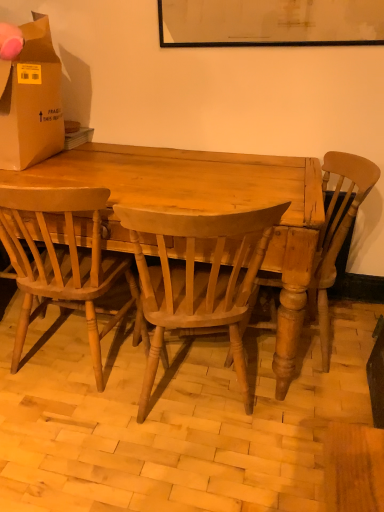
Question: Is light brown wood chair at center, which ranks as the 3th chair in left-to-right order, far away from brown cardboard box at upper left?

Choices:
 (A) no
 (B) yes

Answer: (B)

Question: From a real-world perspective, is light brown wood chair at center, which ranks as the 3th chair in left-to-right order, over brown cardboard box at upper left?

Choices:
 (A) yes
 (B) no

Answer: (B)

Question: From the image's perspective, is light brown wood chair at center, which ranks as the 3th chair in left-to-right order, located above brown cardboard box at upper left?

Choices:
 (A) yes
 (B) no

Answer: (B)

Question: Does light brown wood chair at center, which ranks as the 3th chair in left-to-right order, have a lesser height compared to brown cardboard box at upper left?

Choices:
 (A) yes
 (B) no

Answer: (B)

Question: Does light brown wood chair at center, acting as the 1th chair starting from the right, come behind brown cardboard box at upper left?

Choices:
 (A) yes
 (B) no

Answer: (B)

Question: Looking at their shapes, would you say brown cardboard box at upper left is wider or thinner than light brown wood chair at center, which is the second chair from right to left?

Choices:
 (A) wide
 (B) thin

Answer: (B)

Question: In terms of size, does brown cardboard box at upper left appear bigger or smaller than light brown wood chair at center, which is the second chair from right to left?

Choices:
 (A) big
 (B) small

Answer: (B)

Question: From the image's perspective, relative to light brown wood chair at center, which is the second chair from right to left, is brown cardboard box at upper left above or below?

Choices:
 (A) above
 (B) below

Answer: (A)

Question: Does point (54, 95) appear closer or farther from the camera than point (243, 311)?

Choices:
 (A) farther
 (B) closer

Answer: (A)

Question: From the image's perspective, is light brown wood desk at center positioned above or below light brown wood chair at center, which ranks as the 3th chair in left-to-right order?

Choices:
 (A) above
 (B) below

Answer: (A)

Question: Considering their positions, is light brown wood desk at center located in front of or behind light brown wood chair at center, which ranks as the 3th chair in left-to-right order?

Choices:
 (A) front
 (B) behind

Answer: (A)

Question: Visually, is light brown wood desk at center positioned to the left or to the right of light brown wood chair at center, which ranks as the 3th chair in left-to-right order?

Choices:
 (A) right
 (B) left

Answer: (B)

Question: Is light brown wood desk at center wider or thinner than light brown wood chair at center, which ranks as the 3th chair in left-to-right order?

Choices:
 (A) wide
 (B) thin

Answer: (A)

Question: Is light brown wood chair at center, placed as the third chair when sorted from right to left, in front of or behind light brown wood chair at center, acting as the 1th chair starting from the right, in the image?

Choices:
 (A) front
 (B) behind

Answer: (A)

Question: Is light brown wood chair at center, placed as the third chair when sorted from right to left, bigger or smaller than light brown wood chair at center, acting as the 1th chair starting from the right?

Choices:
 (A) small
 (B) big

Answer: (A)